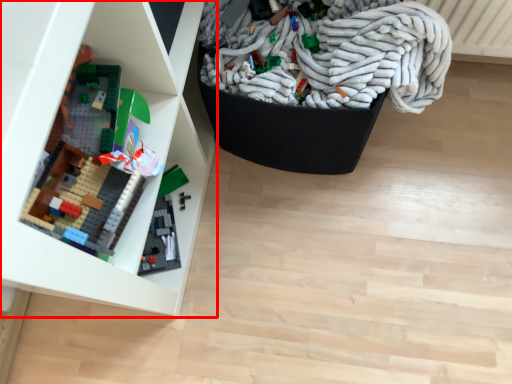
Question: Considering the relative positions of shelf (annotated by the red box) and wrap in the image provided, where is shelf (annotated by the red box) located with respect to the staircase?

Choices:
 (A) right
 (B) left

Answer: (B)